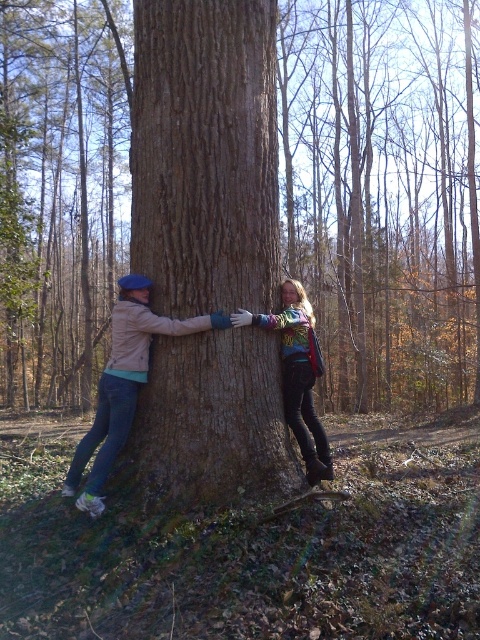
Question: Can you confirm if brown rough textured tree trunk at center is thinner than brown rough tree trunk at center?

Choices:
 (A) yes
 (B) no

Answer: (B)

Question: Which of the following is the farthest from the observer?

Choices:
 (A) (336, 284)
 (B) (236, 284)
 (C) (284, 381)

Answer: (A)

Question: Can you confirm if brown rough textured tree trunk at center is positioned above rainbow-patterned sweater at center?

Choices:
 (A) yes
 (B) no

Answer: (A)

Question: Which object is the farthest from the rainbow-patterned sweater at center?

Choices:
 (A) brown rough tree trunk at center
 (B) matte brown tree trunk at center
 (C) brown rough textured tree trunk at center

Answer: (C)

Question: Estimate the real-world distances between objects in this image. Which object is farther from the rainbow-patterned sweater at center?

Choices:
 (A) brown rough textured tree trunk at center
 (B) brown rough tree trunk at center

Answer: (A)

Question: Can you confirm if matte brown tree trunk at center is thinner than rainbow-patterned sweater at center?

Choices:
 (A) no
 (B) yes

Answer: (A)